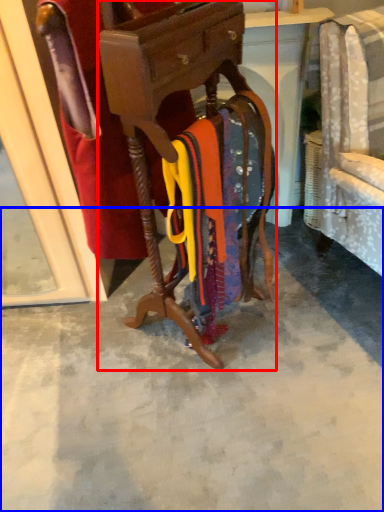
Question: Which object is further to the camera taking this photo, furniture (highlighted by a red box) or concrete (highlighted by a blue box)?

Choices:
 (A) furniture
 (B) concrete

Answer: (B)